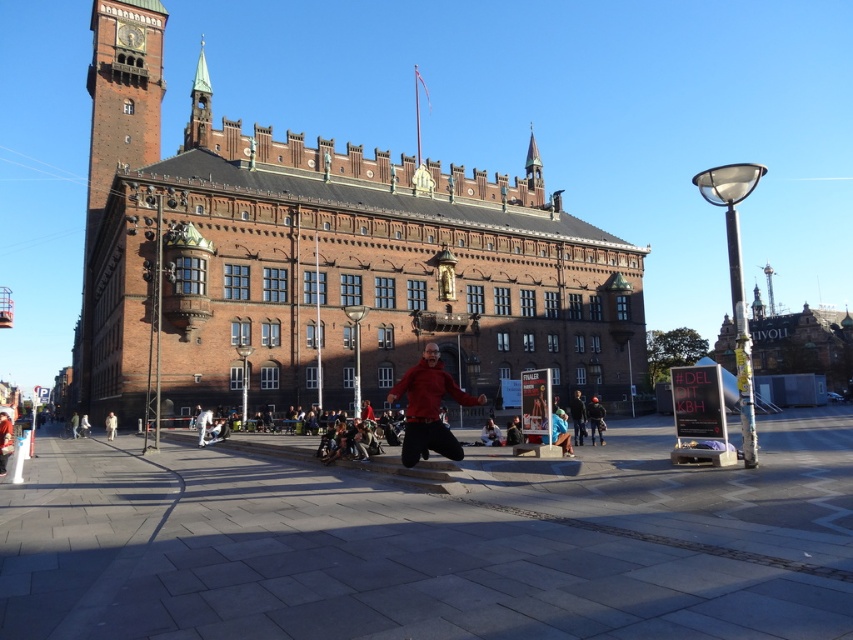
Measure the distance from dark blue jeans at lower right to dark brown leather jacket at center.

They are 21.19 feet apart.

Does point (596, 412) come closer to viewer compared to point (515, 420)?

No, it is not.

Is point (595, 413) behind point (514, 419)?

No, it is in front of (514, 419).

Find the location of a particular element. dark blue jeans at lower right is located at coordinates (595, 419).

Looking at this image, is matte red pants at center below dark brown leather jacket at center?

No.

This screenshot has width=853, height=640. Describe the element at coordinates (491, 433) in the screenshot. I see `matte red pants at center` at that location.

Find the location of a particular element. This screenshot has height=640, width=853. matte red pants at center is located at coordinates (491, 433).

From the picture: Between brick tower at left and dark blue jeans at lower right, which one has less height?

Standing shorter between the two is dark blue jeans at lower right.

Is point (103, 84) positioned in front of point (592, 428)?

No, (103, 84) is behind (592, 428).

Identify the location of brick tower at left. The image size is (853, 640). (114, 177).